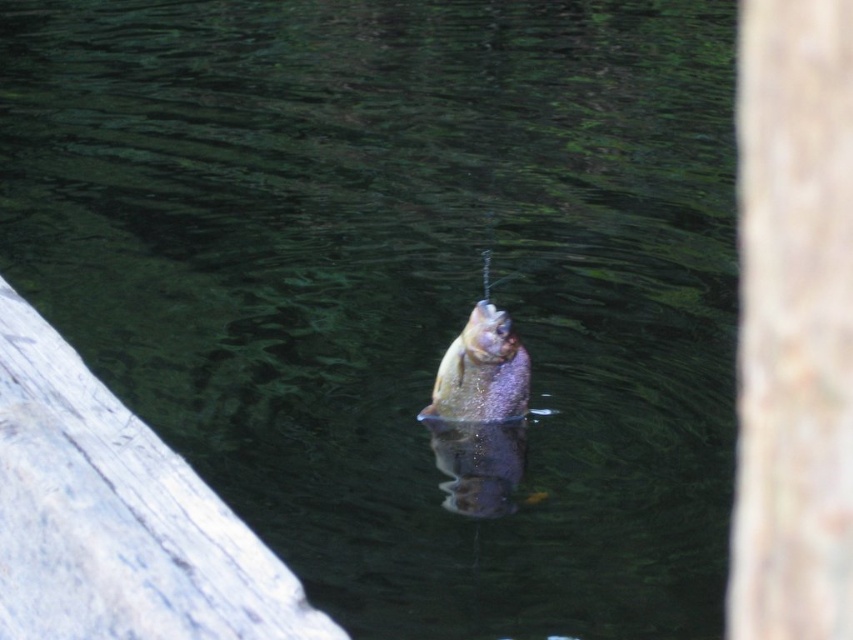
Question: Can you confirm if smooth brown tree trunk at right is bigger than shiny purple fish at center?

Choices:
 (A) no
 (B) yes

Answer: (B)

Question: Does smooth brown tree trunk at right have a greater width compared to shiny purple fish at center?

Choices:
 (A) yes
 (B) no

Answer: (A)

Question: Which point is farther to the camera?

Choices:
 (A) smooth brown tree trunk at right
 (B) shiny purple fish at center

Answer: (B)

Question: Does smooth brown tree trunk at right lie behind shiny purple fish at center?

Choices:
 (A) yes
 (B) no

Answer: (B)

Question: Which point is closer to the camera?

Choices:
 (A) shiny purple fish at center
 (B) smooth brown tree trunk at right

Answer: (B)